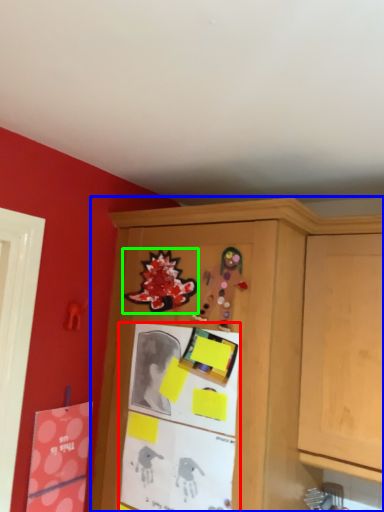
Question: Considering the real-world distances, which object is closest to bulletin board (highlighted by a red box)? cabinetry (highlighted by a blue box) or art (highlighted by a green box).

Choices:
 (A) cabinetry
 (B) art

Answer: (A)